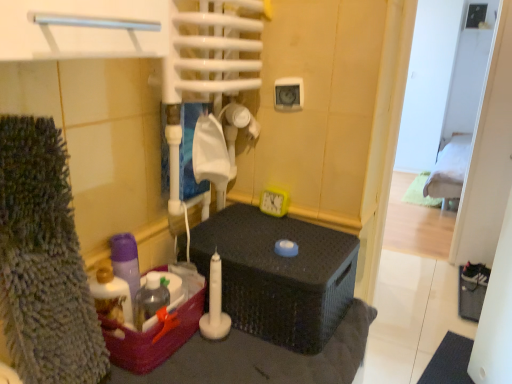
Question: Does translucent plastic basket at lower left come in front of matte black wicker basket at center?

Choices:
 (A) no
 (B) yes

Answer: (B)

Question: Does translucent plastic basket at lower left turn towards matte black wicker basket at center?

Choices:
 (A) yes
 (B) no

Answer: (B)

Question: From a real-world perspective, is translucent plastic basket at lower left located higher than matte black wicker basket at center?

Choices:
 (A) yes
 (B) no

Answer: (B)

Question: Is translucent plastic basket at lower left taller than matte black wicker basket at center?

Choices:
 (A) no
 (B) yes

Answer: (A)

Question: Would you say translucent plastic basket at lower left is a long distance from matte black wicker basket at center?

Choices:
 (A) yes
 (B) no

Answer: (B)

Question: Relative to translucent plastic bottle at lower left, is green fabric bed at upper right in front or behind?

Choices:
 (A) front
 (B) behind

Answer: (B)

Question: Is green fabric bed at upper right taller or shorter than translucent plastic bottle at lower left?

Choices:
 (A) tall
 (B) short

Answer: (A)

Question: In terms of size, does green fabric bed at upper right appear bigger or smaller than translucent plastic bottle at lower left?

Choices:
 (A) small
 (B) big

Answer: (B)

Question: Is green fabric bed at upper right inside or outside of translucent plastic bottle at lower left?

Choices:
 (A) outside
 (B) inside

Answer: (A)

Question: Choose the correct answer: Is translucent plastic basket at lower left inside matte black wicker basket at center or outside it?

Choices:
 (A) outside
 (B) inside

Answer: (A)

Question: From a real-world perspective, is translucent plastic basket at lower left above or below matte black wicker basket at center?

Choices:
 (A) below
 (B) above

Answer: (A)

Question: From the image's perspective, relative to matte black wicker basket at center, is translucent plastic basket at lower left above or below?

Choices:
 (A) below
 (B) above

Answer: (A)

Question: Is translucent plastic basket at lower left wider or thinner than matte black wicker basket at center?

Choices:
 (A) thin
 (B) wide

Answer: (A)

Question: From their relative heights in the image, would you say translucent plastic bottle at lower left is taller or shorter than green fabric bed at upper right?

Choices:
 (A) tall
 (B) short

Answer: (B)

Question: Based on their positions, is translucent plastic bottle at lower left located to the left or right of green fabric bed at upper right?

Choices:
 (A) left
 (B) right

Answer: (A)